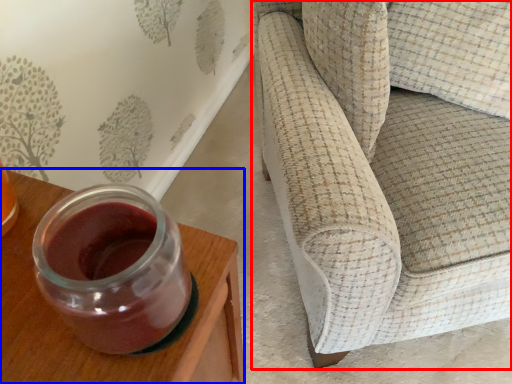
Question: Which object appears farthest to the camera in this image, studio couch (highlighted by a red box) or furniture (highlighted by a blue box)?

Choices:
 (A) studio couch
 (B) furniture

Answer: (A)